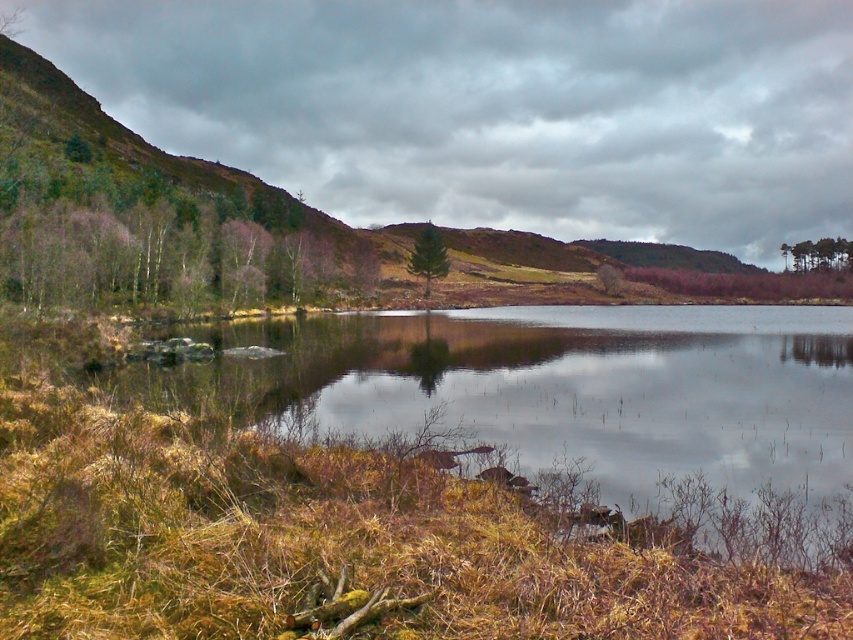
You are an environmental scientist observing the landscape. You notice the green matte tree at upper right and the green matte tree at center. Which tree would cast a shorter shadow during midday when the sun is directly overhead?

The green matte tree at upper right has a lesser height compared to the green matte tree at center, so it would cast a shorter shadow during midday when the sun is directly overhead.

You are standing at the center of the image and want to locate the smooth reflective water at lower center. According to the coordinates provided, in which direction should you look to find it?

The smooth reflective water at lower center is located at coordinates point (569, 401), so you should look downward and to the right from the center to find it.

You are standing at the center of the image and want to locate the smooth reflective water at lower center. According to the coordinates provided, in which direction should you look to find it?

The smooth reflective water at lower center is located at point 0.627 on the x axis and 0.668 on the y axis. Since the coordinates are given as x,y, and the center is at (426, 320), you should look to the right and slightly upwards from the center point to locate it.